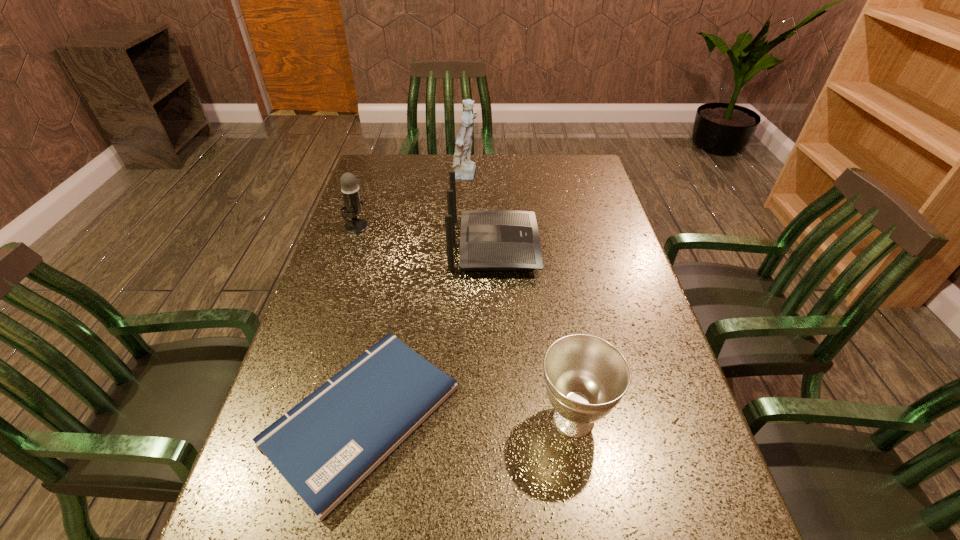
Where is `free location that satisfies the following two spatial constraints: 1. on the front side of the paperback book; 2. on the left side of the chalice`? This screenshot has height=540, width=960. free location that satisfies the following two spatial constraints: 1. on the front side of the paperback book; 2. on the left side of the chalice is located at coordinates point(361,419).

At what (x,y) coordinates should I click in order to perform the action: click on free space that satisfies the following two spatial constraints: 1. on the front-facing side of the router; 2. on the front-facing side of the farthest object. Please return your answer as a coordinate pair (x, y). Looking at the image, I should click on 492,177.

This screenshot has width=960, height=540. I want to click on vacant position in the image that satisfies the following two spatial constraints: 1. on the front-facing side of the figurine; 2. on the back side of the chalice, so click(x=458, y=419).

Where is `vacant area that satisfies the following two spatial constraints: 1. on the front-facing side of the chalice; 2. on the right side of the tallest object`? vacant area that satisfies the following two spatial constraints: 1. on the front-facing side of the chalice; 2. on the right side of the tallest object is located at coordinates (458, 419).